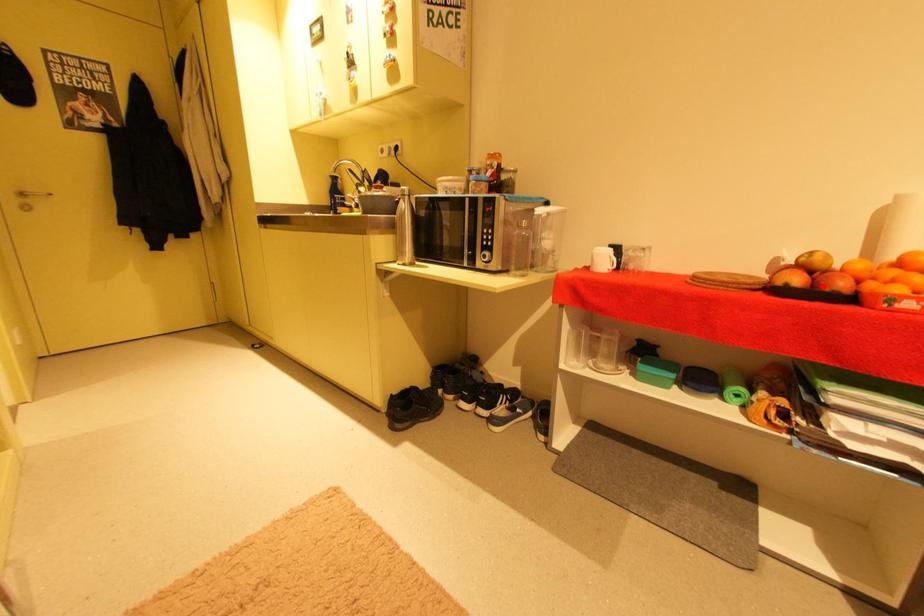
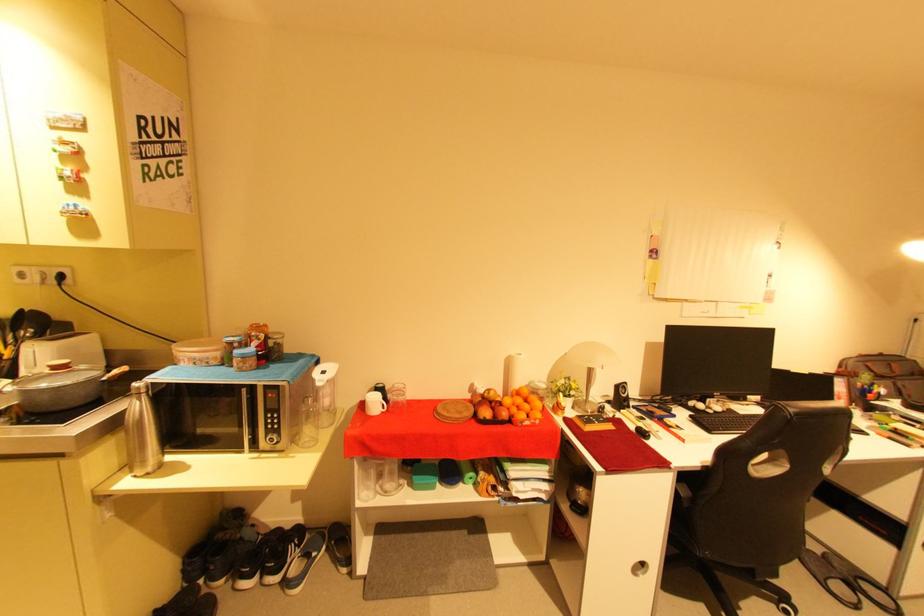
In the second image, find the point that corresponds to the highlighted location in the first image.

(503, 416)